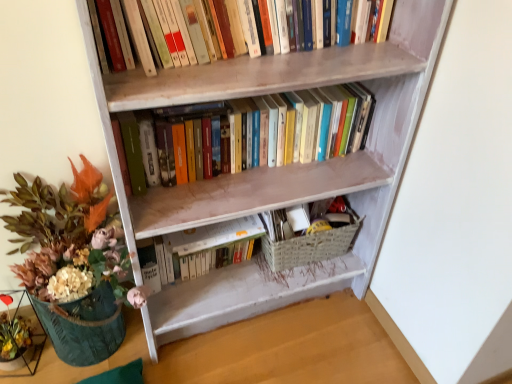
Question: Should I look upward or downward to see woven beige basket at lower center?

Choices:
 (A) down
 (B) up

Answer: (A)

Question: Would you say hardcover books at center, the second book when ordered from top to bottom, is outside hardcover books at upper center, which ranks as the third book in bottom-to-top order?

Choices:
 (A) no
 (B) yes

Answer: (B)

Question: Is hardcover books at center, the second book when ordered from top to bottom, far from hardcover books at upper center, which ranks as the third book in bottom-to-top order?

Choices:
 (A) no
 (B) yes

Answer: (A)

Question: Considering the relative sizes of hardcover books at center, the second book when ordered from top to bottom, and hardcover books at upper center, marked as the 1th book in a top-to-bottom arrangement, in the image provided, is hardcover books at center, the second book when ordered from top to bottom, wider than hardcover books at upper center, marked as the 1th book in a top-to-bottom arrangement,?

Choices:
 (A) yes
 (B) no

Answer: (B)

Question: Is hardcover books at center, which is the 2th book in bottom-to-top order, shorter than hardcover books at upper center, which ranks as the third book in bottom-to-top order?

Choices:
 (A) yes
 (B) no

Answer: (B)

Question: Is hardcover books at center, the second book when ordered from top to bottom, further to the viewer compared to hardcover books at upper center, which ranks as the third book in bottom-to-top order?

Choices:
 (A) no
 (B) yes

Answer: (B)

Question: Can you confirm if hardcover books at center, the second book when ordered from top to bottom, is smaller than hardcover books at upper center, marked as the 1th book in a top-to-bottom arrangement?

Choices:
 (A) no
 (B) yes

Answer: (A)

Question: Are woven beige basket at lower center and hardcover books at upper center, marked as the 1th book in a top-to-bottom arrangement, making contact?

Choices:
 (A) yes
 (B) no

Answer: (B)

Question: Is woven beige basket at lower center wider than hardcover books at upper center, which ranks as the third book in bottom-to-top order?

Choices:
 (A) no
 (B) yes

Answer: (B)

Question: Does woven beige basket at lower center have a smaller size compared to hardcover books at upper center, marked as the 1th book in a top-to-bottom arrangement?

Choices:
 (A) no
 (B) yes

Answer: (B)

Question: Is hardcover books at upper center, marked as the 1th book in a top-to-bottom arrangement, inside woven beige basket at lower center?

Choices:
 (A) yes
 (B) no

Answer: (B)

Question: Does woven beige basket at lower center have a lesser width compared to hardcover books at upper center, which ranks as the third book in bottom-to-top order?

Choices:
 (A) yes
 (B) no

Answer: (B)

Question: From the image's perspective, would you say woven beige basket at lower center is shown under hardcover books at upper center, marked as the 1th book in a top-to-bottom arrangement?

Choices:
 (A) no
 (B) yes

Answer: (B)

Question: Can woven beige basket at lower center be found inside wooden bookcase at center?

Choices:
 (A) yes
 (B) no

Answer: (A)